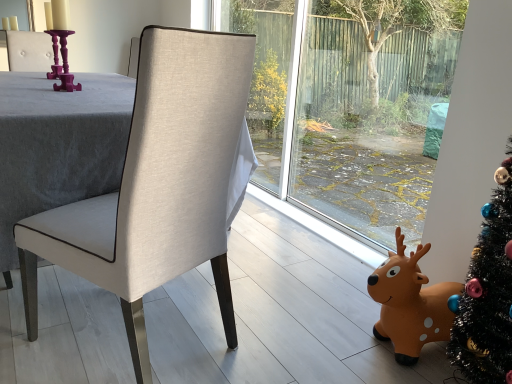
Identify the location of vacant area located to the right-hand side of purple glossy candle holder at upper left. The width and height of the screenshot is (512, 384). click(101, 92).